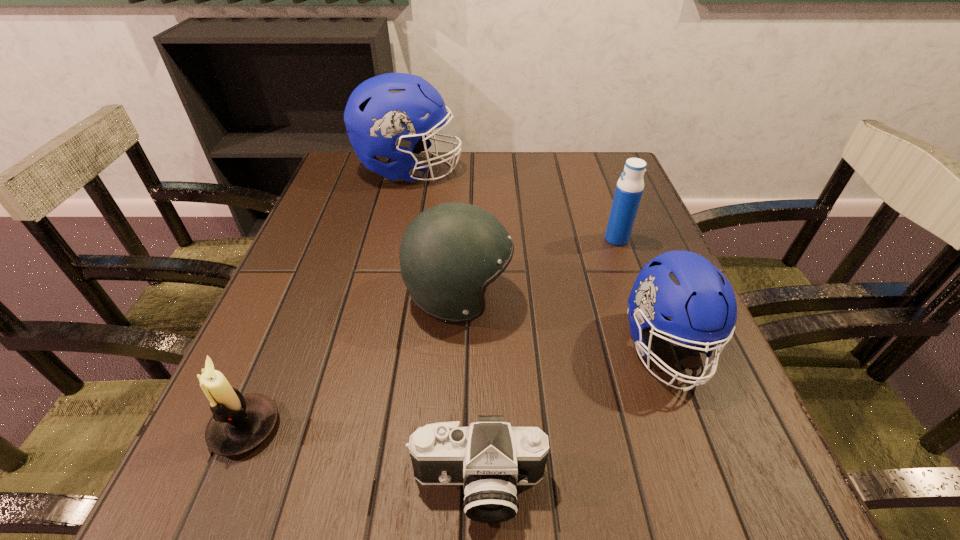
Locate an element on the screen. Image resolution: width=960 pixels, height=540 pixels. free space located on the back of the camera is located at coordinates (478, 319).

Where is `object located at the far edge`? This screenshot has height=540, width=960. object located at the far edge is located at coordinates (382, 116).

Identify the location of candle holder situated at the near edge. This screenshot has width=960, height=540. (240, 423).

What are the coordinates of `camera at the near edge` in the screenshot? It's located at (490, 458).

I want to click on football helmet located at the left edge, so click(x=382, y=116).

Where is `candle holder that is at the left edge`? The image size is (960, 540). candle holder that is at the left edge is located at coordinates (240, 423).

At what (x,y) coordinates should I click in order to perform the action: click on water bottle present at the right edge. Please return your answer as a coordinate pair (x, y). Looking at the image, I should click on (629, 188).

You are a GUI agent. You are given a task and a screenshot of the screen. Output one action in this format:
    pyautogui.click(x=<x>, y=<y>)
    Task: Click on the football helmet that is positioned at the right edge
    
    Given the screenshot: What is the action you would take?
    pyautogui.click(x=682, y=285)

Identify the location of object that is positioned at the far left corner. (382, 116).

Find the location of a particular element. object that is at the near left corner is located at coordinates (240, 423).